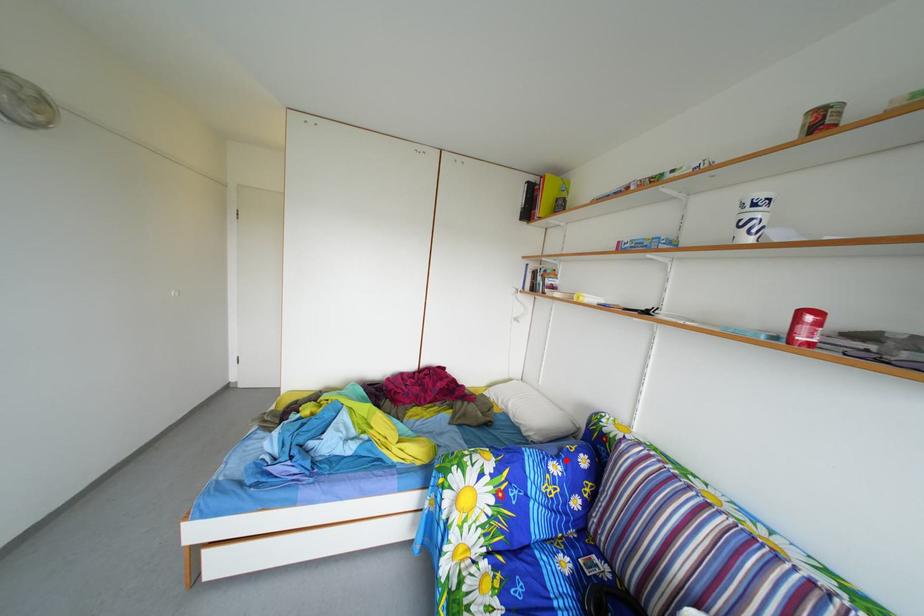
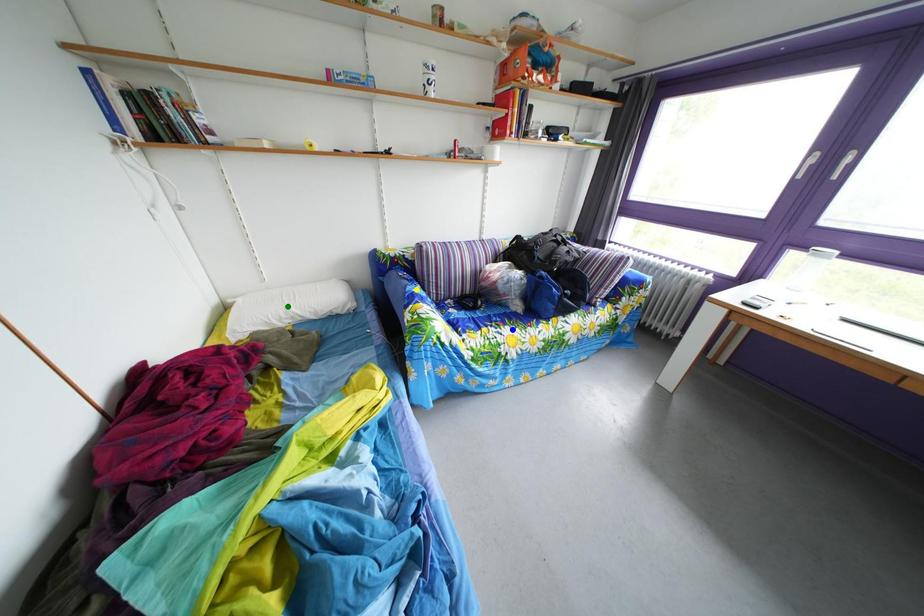
Question: I am providing you with two images of the same scene from different viewpoints. A red point is marked on the first image. You are given multiple points on the second image. Which spot in image 2 lines up with the point in image 1?

Choices:
 (A) green point
 (B) yellow point
 (C) blue point

Answer: (B)